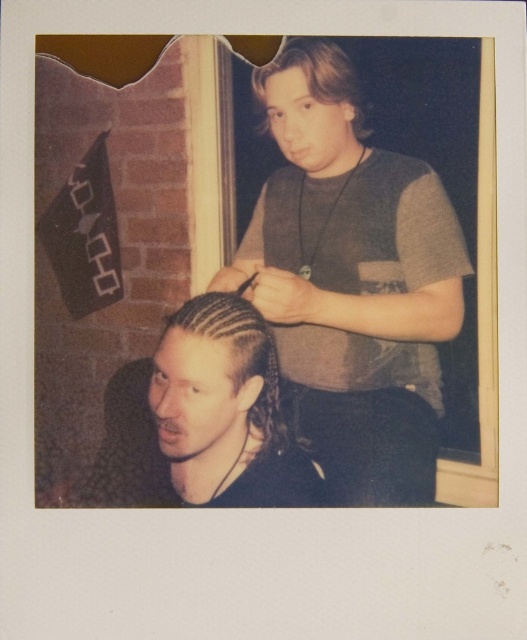
Question: Which point is closer to the camera?

Choices:
 (A) gray fabric shirt at upper center
 (B) light brown wavy hair at upper center

Answer: (A)

Question: Which of these objects is positioned farthest from the gray fabric shirt at upper center?

Choices:
 (A) light brown wavy hair at upper center
 (B) black braided hair at center

Answer: (A)

Question: Which point is farther to the camera?

Choices:
 (A) black braided hair at center
 (B) light brown wavy hair at upper center
 (C) gray fabric shirt at upper center

Answer: (B)

Question: Can you confirm if black braided hair at center is thinner than light brown wavy hair at upper center?

Choices:
 (A) no
 (B) yes

Answer: (A)

Question: Does gray fabric shirt at upper center appear on the right side of light brown wavy hair at upper center?

Choices:
 (A) yes
 (B) no

Answer: (A)

Question: Is black braided hair at center above light brown wavy hair at upper center?

Choices:
 (A) yes
 (B) no

Answer: (B)